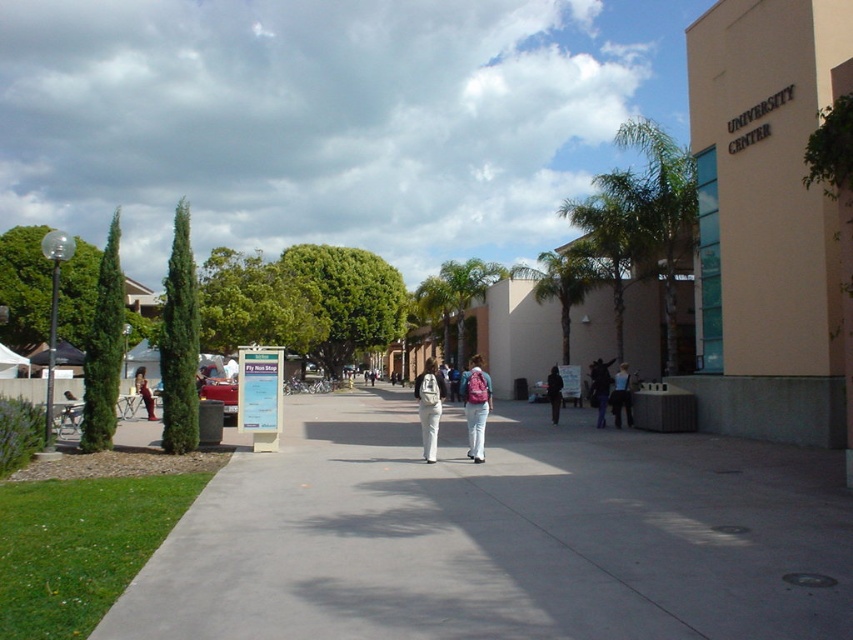
Looking at this image, you are a student walking on the university campus and see both the pink backpack at center and the blue fabric backpack at center. Which backpack is placed higher up?

The pink backpack at center is positioned over the blue fabric backpack at center, so the pink backpack at center is placed higher up.

You are a student who needs to carry both the pink backpack at center and the blue fabric backpack at center. If you want to place one on top of the other, which backpack should go on the bottom to ensure stability?

The blue fabric backpack at center should go on the bottom because it is wider than the pink backpack at center, providing a stable base for stacking.